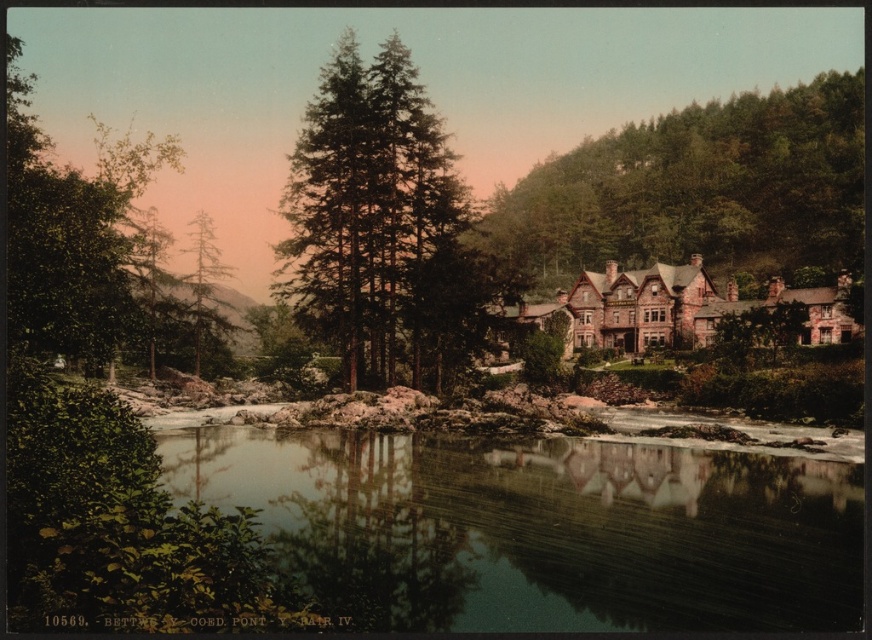
You are standing in front of the historic building and notice two trees in the scene. Which tree, the green leafy tree at upper right or the green textured tree at center, is closer to you?

→ The green leafy tree at upper right is closer to you because the green textured tree at center is positioned behind it.

You are standing in front of the historic building and notice two trees in the scene. Which tree, the green textured tree at center or the green matte tree at upper left, reaches a greater height?

The green textured tree at center is taller than the green matte tree at upper left.